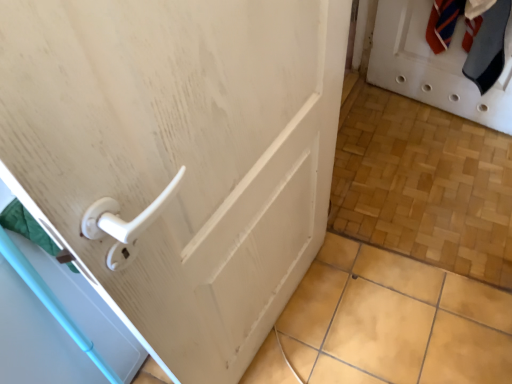
What do you see at coordinates (434, 66) in the screenshot? The height and width of the screenshot is (384, 512). I see `white matte door at upper right` at bounding box center [434, 66].

Locate an element on the screen. The image size is (512, 384). white matte door at upper right is located at coordinates pos(434,66).

Image resolution: width=512 pixels, height=384 pixels. I want to click on white plastic handle at left, so click(36, 340).

What do you see at coordinates (36, 340) in the screenshot? Image resolution: width=512 pixels, height=384 pixels. I see `white plastic handle at left` at bounding box center [36, 340].

What is the approximate width of white plastic handle at left?

15.05 inches.

You are a GUI agent. You are given a task and a screenshot of the screen. Output one action in this format:
    pyautogui.click(x=<x>, y=<y>)
    Task: Click on the white matte door at upper right
    Image resolution: width=512 pixels, height=384 pixels.
    Given the screenshot: What is the action you would take?
    pyautogui.click(x=434, y=66)

Between white plastic handle at left and white matte door at upper right, which one appears on the left side from the viewer's perspective?

From the viewer's perspective, white plastic handle at left appears more on the left side.

Which object is more forward, white plastic handle at left or white matte door at upper right?

white plastic handle at left.

Based on the photo, which point is more distant from viewer, (6, 318) or (407, 75)?

The point (407, 75) is more distant.

From the image's perspective, which one is positioned higher, white plastic handle at left or white matte door at upper right?

white matte door at upper right is shown above in the image.

From a real-world perspective, is white plastic handle at left beneath white matte door at upper right?

Yes, from a real-world perspective, white plastic handle at left is beneath white matte door at upper right.

Does white plastic handle at left have a greater width compared to white matte door at upper right?

Indeed, white plastic handle at left has a greater width compared to white matte door at upper right.

Considering the sizes of white plastic handle at left and white matte door at upper right in the image, is white plastic handle at left taller or shorter than white matte door at upper right?

In the image, white plastic handle at left appears to be taller than white matte door at upper right.

Looking at this image, between white plastic handle at left and white matte door at upper right, which one has larger size?

Bigger between the two is white plastic handle at left.

Looking at this image, would you say white plastic handle at left is inside or outside white matte door at upper right?

white plastic handle at left cannot be found inside white matte door at upper right.

Is white plastic handle at left not near white matte door at upper right?

Yes, white plastic handle at left is far from white matte door at upper right.

Is white plastic handle at left facing towards white matte door at upper right?

No.

Can you tell me how much white plastic handle at left and white matte door at upper right differ in facing direction?

There is a 7.17-degree angle between the facing directions of white plastic handle at left and white matte door at upper right.

In order to click on screen door on the left of white matte door at upper right in this screenshot , I will do `click(36, 340)`.

Considering the relative positions of white matte door at upper right and white plastic handle at left in the image provided, is white matte door at upper right to the left of white plastic handle at left from the viewer's perspective?

In fact, white matte door at upper right is to the right of white plastic handle at left.

Between white matte door at upper right and white plastic handle at left, which one is positioned in front?

white plastic handle at left is closer to the camera.

Does point (411, 79) come in front of point (89, 380)?

No, (411, 79) is further to viewer.

From the image's perspective, is white matte door at upper right above white plastic handle at left?

Yes, from the image's perspective, white matte door at upper right is over white plastic handle at left.

From a real-world perspective, between white matte door at upper right and white plastic handle at left, who is vertically lower?

From a 3D spatial view, white plastic handle at left is below.

Looking at their sizes, would you say white matte door at upper right is wider or thinner than white plastic handle at left?

Clearly, white matte door at upper right has less width compared to white plastic handle at left.

Which of these two, white matte door at upper right or white plastic handle at left, stands shorter?

With less height is white matte door at upper right.

Does white matte door at upper right have a smaller size compared to white plastic handle at left?

Yes.

Do you think white matte door at upper right is within white plastic handle at left, or outside of it?

white matte door at upper right is not enclosed by white plastic handle at left.

Is white matte door at upper right beside white plastic handle at left?

No, white matte door at upper right is not in contact with white plastic handle at left.

Could you tell me if white matte door at upper right is facing white plastic handle at left?

Yes, white matte door at upper right faces towards white plastic handle at left.

Based on the photo, how many degrees apart are the facing directions of white matte door at upper right and white plastic handle at left?

7.17 degrees.

I want to click on screen door on the left side of white matte door at upper right, so click(36, 340).

Locate an element on the screen. The image size is (512, 384). door on the right of white plastic handle at left is located at coordinates (434, 66).

Locate an element on the screen. door above the white plastic handle at left (from the image's perspective) is located at coordinates (434, 66).